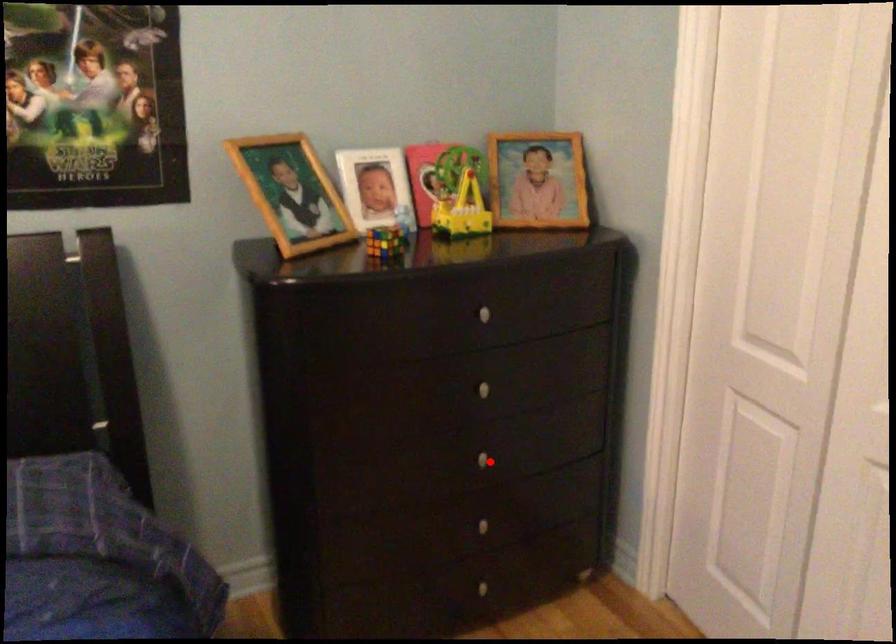
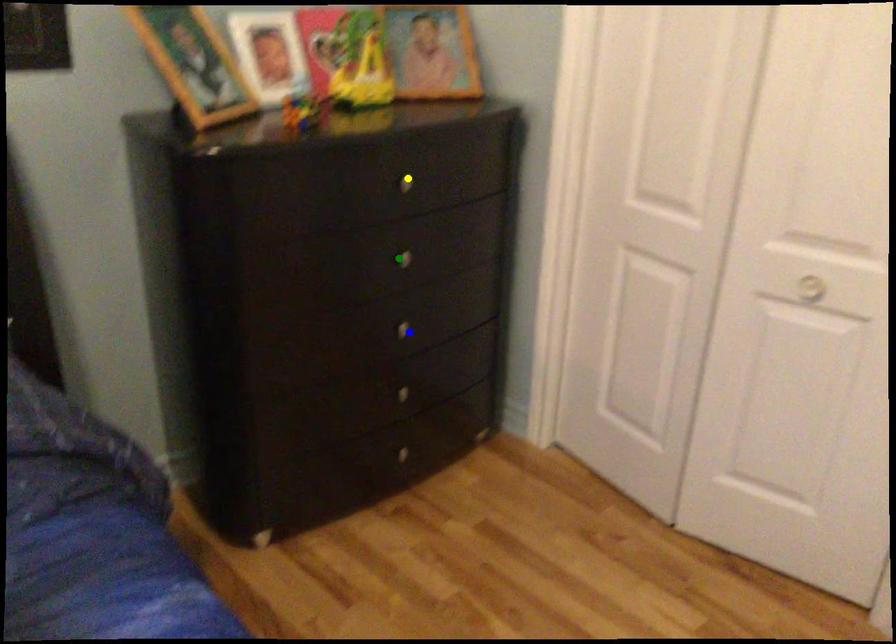
Question: I am providing you with two images of the same scene from different viewpoints. A red point is marked on the first image. You are given multiple points on the second image. Which spot in image 2 lines up with the point in image 1?

Choices:
 (A) yellow point
 (B) green point
 (C) blue point

Answer: (C)